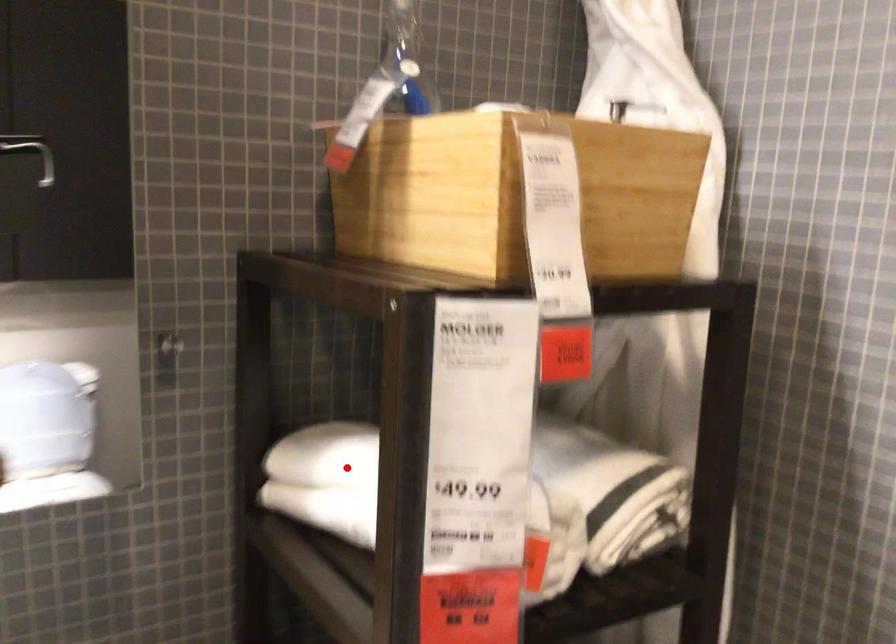
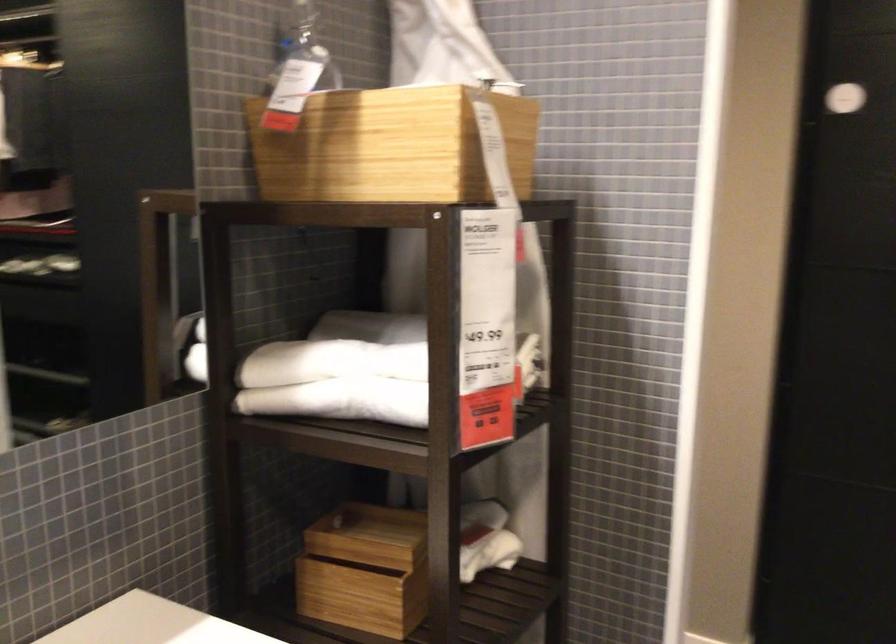
Find the pixel in the second image that matches the highlighted location in the first image.

(330, 362)